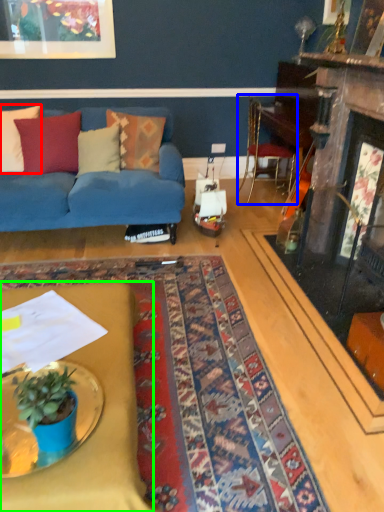
Question: Which is farther away from pillow (highlighted by a red box)? chair (highlighted by a blue box) or desk (highlighted by a green box)?

Choices:
 (A) chair
 (B) desk

Answer: (A)